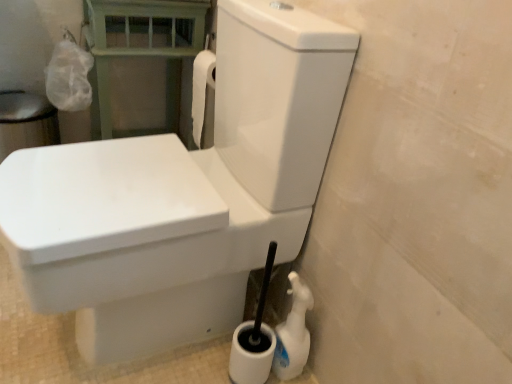
Question: Is white plastic spray bottle at lower right behind white glossy toilet at center?

Choices:
 (A) no
 (B) yes

Answer: (B)

Question: Is white plastic spray bottle at lower right oriented towards white glossy toilet at center?

Choices:
 (A) no
 (B) yes

Answer: (A)

Question: Can you confirm if white plastic spray bottle at lower right is taller than white glossy toilet at center?

Choices:
 (A) no
 (B) yes

Answer: (A)

Question: Does white plastic spray bottle at lower right have a lesser height compared to white glossy toilet at center?

Choices:
 (A) yes
 (B) no

Answer: (A)

Question: Is white plastic spray bottle at lower right next to white glossy toilet at center and touching it?

Choices:
 (A) yes
 (B) no

Answer: (B)

Question: Relative to white glossy toilet at center, is white plastic spray bottle at lower right in front or behind?

Choices:
 (A) front
 (B) behind

Answer: (B)

Question: Does point (285, 321) appear closer or farther from the camera than point (58, 190)?

Choices:
 (A) closer
 (B) farther

Answer: (B)

Question: Is white plastic spray bottle at lower right taller or shorter than white glossy toilet at center?

Choices:
 (A) tall
 (B) short

Answer: (B)

Question: From the image's perspective, is white plastic spray bottle at lower right positioned above or below white glossy toilet at center?

Choices:
 (A) above
 (B) below

Answer: (B)

Question: In terms of size, does white glossy toilet at center appear bigger or smaller than green painted wood balustrade at upper left?

Choices:
 (A) big
 (B) small

Answer: (A)

Question: Considering the positions of white glossy toilet at center and green painted wood balustrade at upper left in the image, is white glossy toilet at center taller or shorter than green painted wood balustrade at upper left?

Choices:
 (A) tall
 (B) short

Answer: (A)

Question: Considering the positions of white glossy toilet at center and green painted wood balustrade at upper left in the image, is white glossy toilet at center wider or thinner than green painted wood balustrade at upper left?

Choices:
 (A) wide
 (B) thin

Answer: (A)

Question: Is white glossy toilet at center inside the boundaries of green painted wood balustrade at upper left, or outside?

Choices:
 (A) inside
 (B) outside

Answer: (B)

Question: Is white plastic spray bottle at lower right spatially inside green painted wood balustrade at upper left, or outside of it?

Choices:
 (A) inside
 (B) outside

Answer: (B)

Question: Is white plastic spray bottle at lower right in front of or behind green painted wood balustrade at upper left in the image?

Choices:
 (A) behind
 (B) front

Answer: (B)